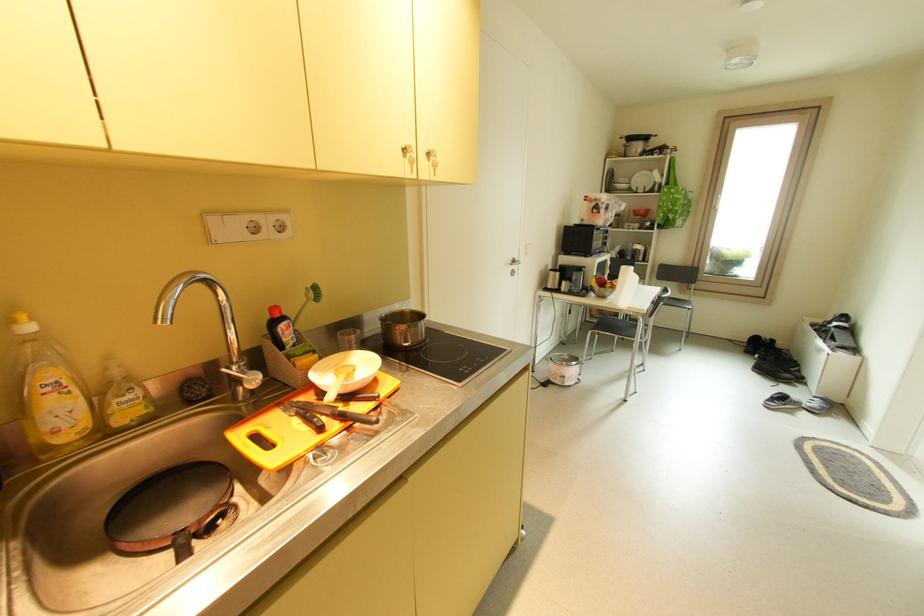
The image size is (924, 616). I want to click on knife handle, so click(365, 416).